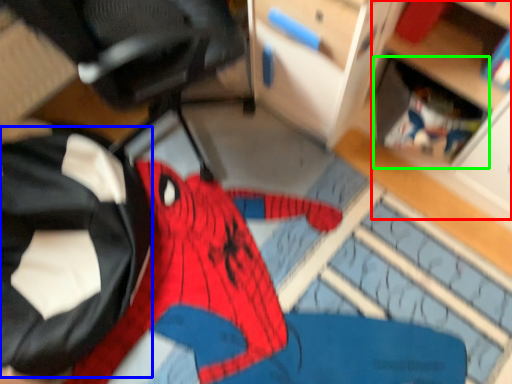
Question: Based on their relative distances, which object is nearer to shelf (highlighted by a red box)? Choose from clothing (highlighted by a blue box) and shelf (highlighted by a green box).

Choices:
 (A) clothing
 (B) shelf

Answer: (B)